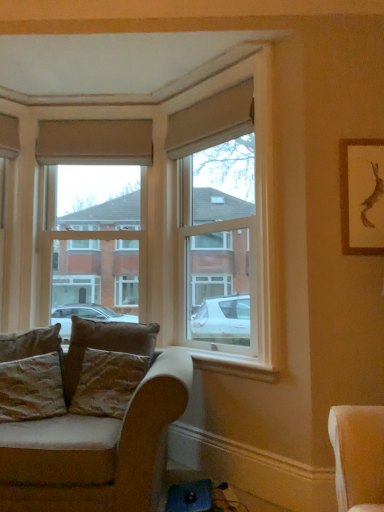
Question: Is velvet brown pillow at lower left, marked as the third pillow in a left-to-right arrangement, located within beige fabric curtain at upper center, the 2th curtain in the front-to-back sequence?

Choices:
 (A) no
 (B) yes

Answer: (A)

Question: Is the position of beige fabric curtain at upper center, the first curtain viewed from the left, more distant than that of velvet brown pillow at lower left, the 1th pillow from the right?

Choices:
 (A) no
 (B) yes

Answer: (B)

Question: Considering the relative sizes of beige fabric curtain at upper center, the first curtain viewed from the left, and velvet brown pillow at lower left, the 1th pillow from the right, in the image provided, is beige fabric curtain at upper center, the first curtain viewed from the left, thinner than velvet brown pillow at lower left, the 1th pillow from the right,?

Choices:
 (A) yes
 (B) no

Answer: (A)

Question: From a real-world perspective, is beige fabric curtain at upper center, acting as the first curtain starting from the back, located beneath velvet brown pillow at lower left, marked as the third pillow in a left-to-right arrangement?

Choices:
 (A) no
 (B) yes

Answer: (A)

Question: Is beige fabric curtain at upper center, the first curtain viewed from the left, closer to camera compared to velvet brown pillow at lower left, the 1th pillow from the right?

Choices:
 (A) yes
 (B) no

Answer: (B)

Question: Is textured beige pillow at lower left, positioned as the third pillow in right-to-left order, wider or thinner than clear glass window at center, arranged as the 2th window when viewed from the right?

Choices:
 (A) wide
 (B) thin

Answer: (A)

Question: Is textured beige pillow at lower left, positioned as the third pillow in right-to-left order, bigger or smaller than clear glass window at center, arranged as the 2th window when viewed from the right?

Choices:
 (A) small
 (B) big

Answer: (A)

Question: From a real-world perspective, is textured beige pillow at lower left, positioned as the third pillow in right-to-left order, positioned above or below clear glass window at center, the 1th window from the left?

Choices:
 (A) below
 (B) above

Answer: (A)

Question: In terms of height, does textured beige pillow at lower left, positioned as the third pillow in right-to-left order, look taller or shorter compared to clear glass window at center, arranged as the 2th window when viewed from the right?

Choices:
 (A) tall
 (B) short

Answer: (B)

Question: Is clear glass window at center, arranged as the 2th window when viewed from the right, wider or thinner than velvet beige couch at lower left?

Choices:
 (A) thin
 (B) wide

Answer: (A)

Question: Does point (41, 231) appear closer or farther from the camera than point (8, 431)?

Choices:
 (A) closer
 (B) farther

Answer: (B)

Question: Based on their positions, is clear glass window at center, arranged as the 2th window when viewed from the right, located to the left or right of velvet beige couch at lower left?

Choices:
 (A) left
 (B) right

Answer: (A)

Question: From the image's perspective, is clear glass window at center, the 1th window from the left, above or below velvet beige couch at lower left?

Choices:
 (A) below
 (B) above

Answer: (B)

Question: Is white painted wood at lower right wider or thinner than beige fabric curtain at upper center, the 2th curtain in the front-to-back sequence?

Choices:
 (A) thin
 (B) wide

Answer: (B)

Question: Does point (205, 361) appear closer or farther from the camera than point (97, 119)?

Choices:
 (A) farther
 (B) closer

Answer: (B)